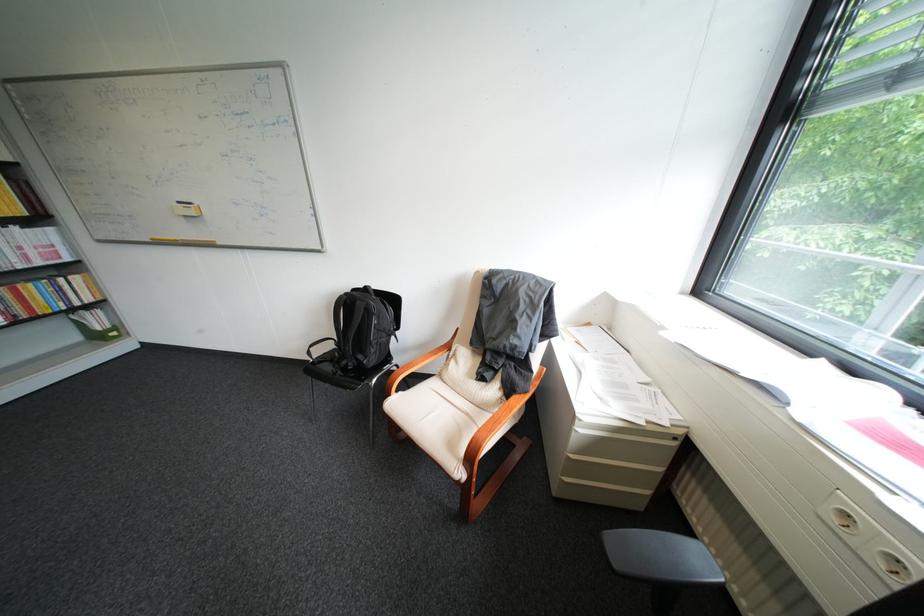
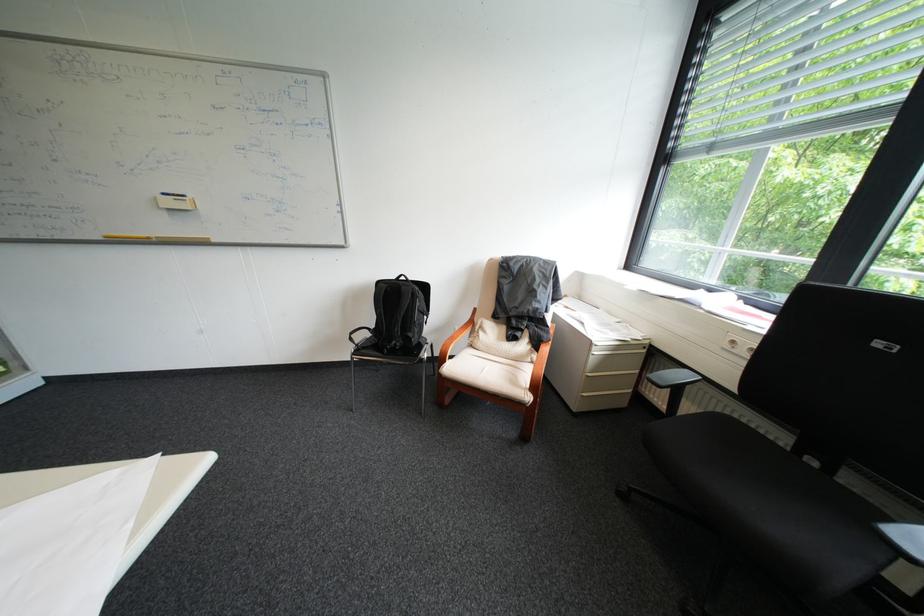
In the second image, find the point that corresponds to point (857, 515) in the first image.

(746, 342)